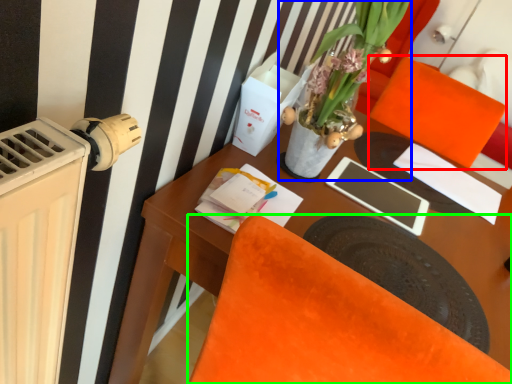
Question: Considering the real-world distances, which object is farthest from armchair (highlighted by a red box)? houseplant (highlighted by a blue box) or chair (highlighted by a green box)?

Choices:
 (A) houseplant
 (B) chair

Answer: (B)